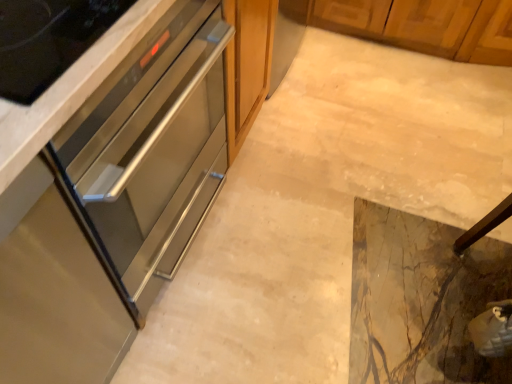
Locate an element on the screen. Image resolution: width=512 pixels, height=384 pixels. free location to the right of stainless steel oven at left, positioned as the 2th cabinetry in top-to-bottom order is located at coordinates (284, 243).